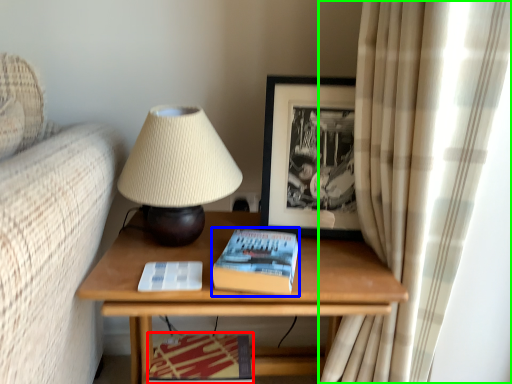
Question: Estimate the real-world distances between objects in this image. Which object is farther from magazine (highlighted by a red box), paperback book (highlighted by a blue box) or curtain (highlighted by a green box)?

Choices:
 (A) paperback book
 (B) curtain

Answer: (B)